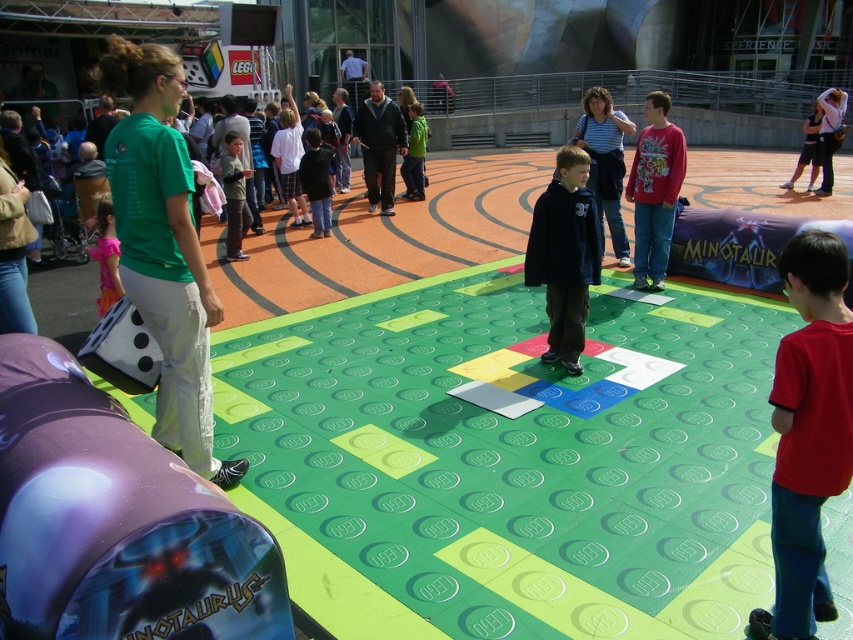
Question: Does red cotton shirt at center appear on the right side of striped cotton shirt at center?

Choices:
 (A) yes
 (B) no

Answer: (A)

Question: Which of the following is the farthest from the observer?

Choices:
 (A) (109, 269)
 (B) (544, 257)
 (C) (577, 132)
 (D) (186, 269)

Answer: (C)

Question: Does red matte shirt at lower right come behind red cotton shirt at center?

Choices:
 (A) yes
 (B) no

Answer: (B)

Question: Estimate the real-world distances between objects in this image. Which object is closer to the red cotton shirt at center?

Choices:
 (A) striped cotton shirt at center
 (B) green fabric pants at left
 (C) floral chiffon dress at lower left

Answer: (A)

Question: Is green fabric pants at left bigger than red matte shirt at lower right?

Choices:
 (A) no
 (B) yes

Answer: (B)

Question: Which of the following is the farthest from the observer?

Choices:
 (A) (151, 300)
 (B) (602, 160)
 (C) (805, 310)

Answer: (B)